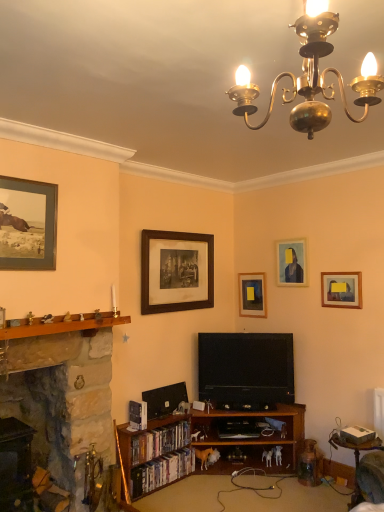
Find the location of a particular element. The height and width of the screenshot is (512, 384). empty space that is ontop of wooden framed print at center, which ranks as the 3th picture frame in back-to-front order (from a real-world perspective) is located at coordinates (176, 230).